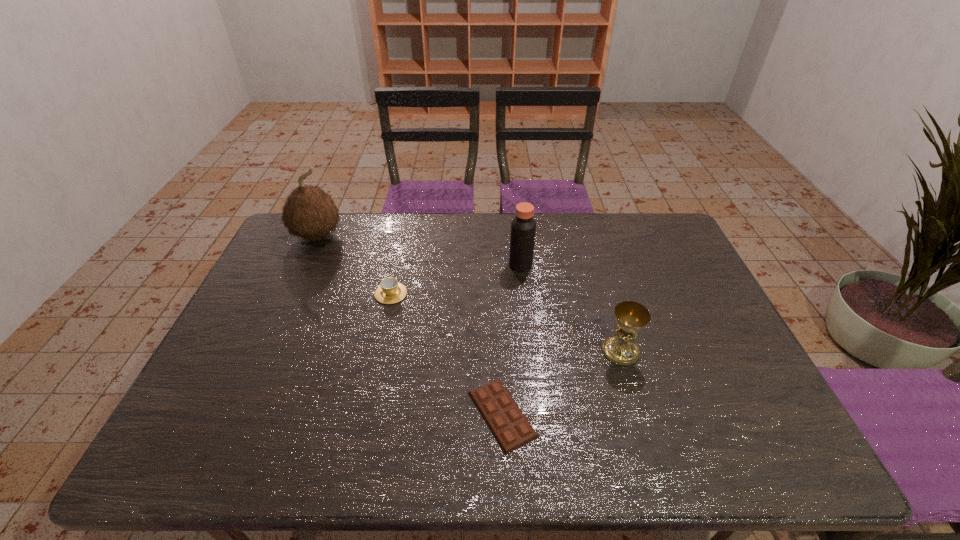
You are a GUI agent. You are given a task and a screenshot of the screen. Output one action in this format:
    pyautogui.click(x=<x>, y=<y>)
    Task: Click on the leftmost object
    
    Given the screenshot: What is the action you would take?
    pyautogui.click(x=309, y=212)

Locate an element on the screen. This screenshot has height=540, width=960. the farthest object is located at coordinates (309, 212).

Find the location of a particular element. The image size is (960, 540). vinegar is located at coordinates (523, 227).

Locate an element on the screen. The image size is (960, 540). the second farthest object is located at coordinates (523, 227).

Where is `the second nearest object`? The height and width of the screenshot is (540, 960). the second nearest object is located at coordinates (631, 316).

Locate an element on the screen. The image size is (960, 540). the rightmost object is located at coordinates coord(631,316).

The image size is (960, 540). Find the location of `the fourth tallest object`. the fourth tallest object is located at coordinates (390, 291).

The height and width of the screenshot is (540, 960). In order to click on cup in this screenshot , I will do `click(390, 291)`.

Where is `chocolate bar`? The image size is (960, 540). chocolate bar is located at coordinates (511, 429).

Image resolution: width=960 pixels, height=540 pixels. I want to click on the shortest object, so click(x=511, y=429).